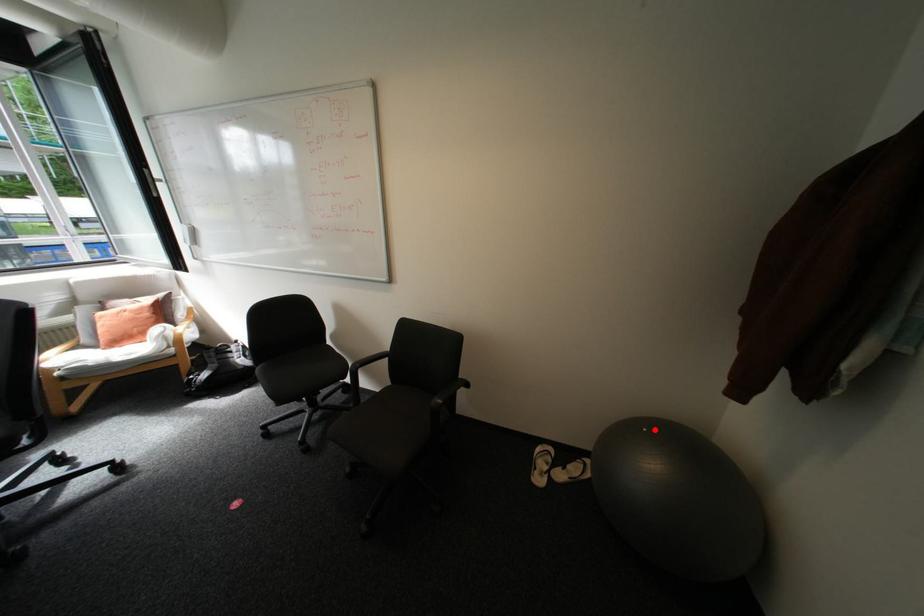
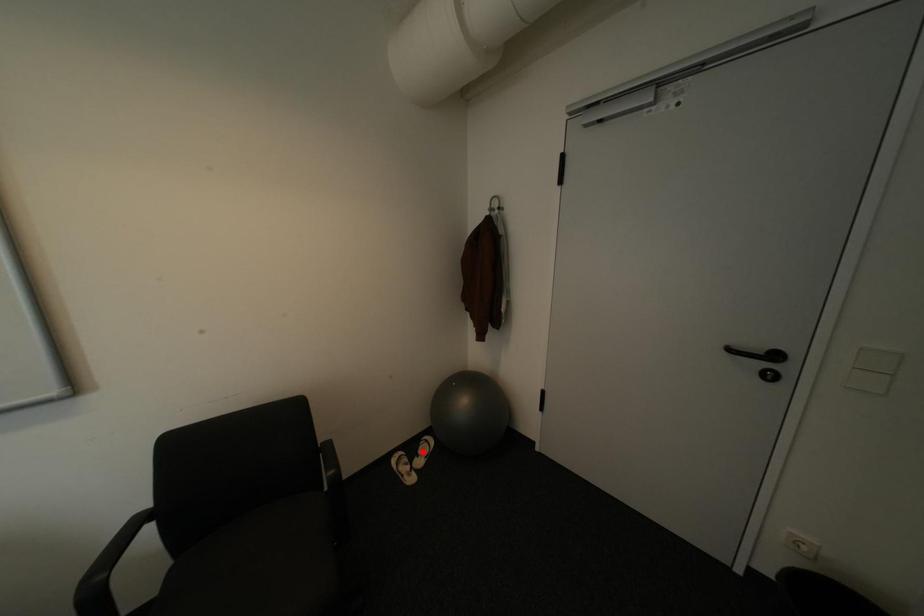
I am providing you with two images of the same scene from different viewpoints. A red point is marked on the first image and another point is marked on the second image. Is the red point in image1 aligned with the point shown in image2?

No